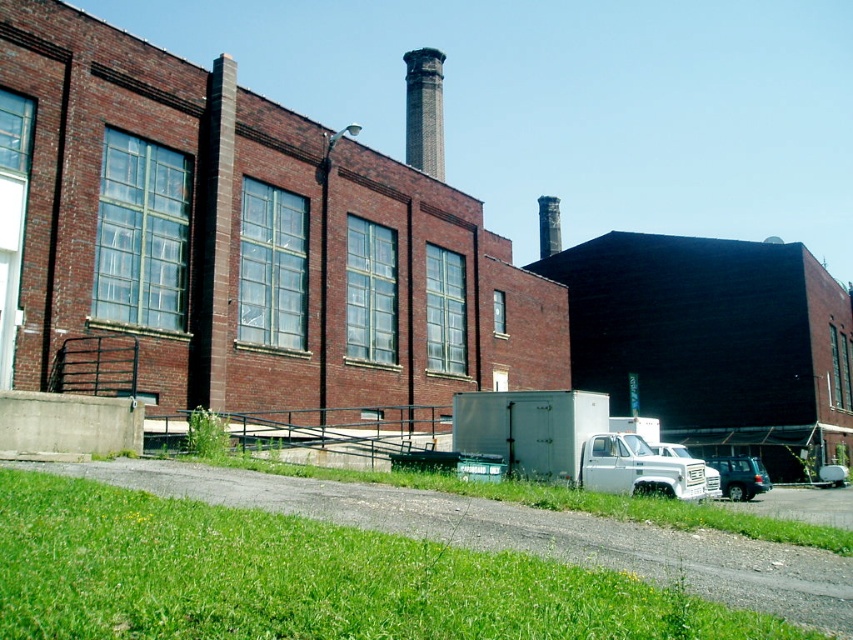
You are a delivery person who needs to unload packages from the matte gray suv at lower right and the white metallic truck at lower right. The loading dock is 10 feet away from both vehicles. Can both vehicles access the loading dock without moving?

The matte gray suv at lower right is only 9.73 feet from the white metallic truck at lower right. Since the loading dock is 10 feet away from both vehicles, both vehicles are within the required distance and can access the loading dock without moving.

You are standing at the entrance of the industrial building and want to locate the matte gray suv at lower right. According to the coordinates provided, where should you look relative to your position?

The matte gray suv at lower right is located at coordinates point (740, 476), which means it is positioned to the lower right relative to your current position at the entrance.

You are standing at point (273, 576) and want to walk towards the building. Is there any obstacle between you and the building?

The green grass at lower left is located at point (273, 576), so there is no obstacle between you and the building.